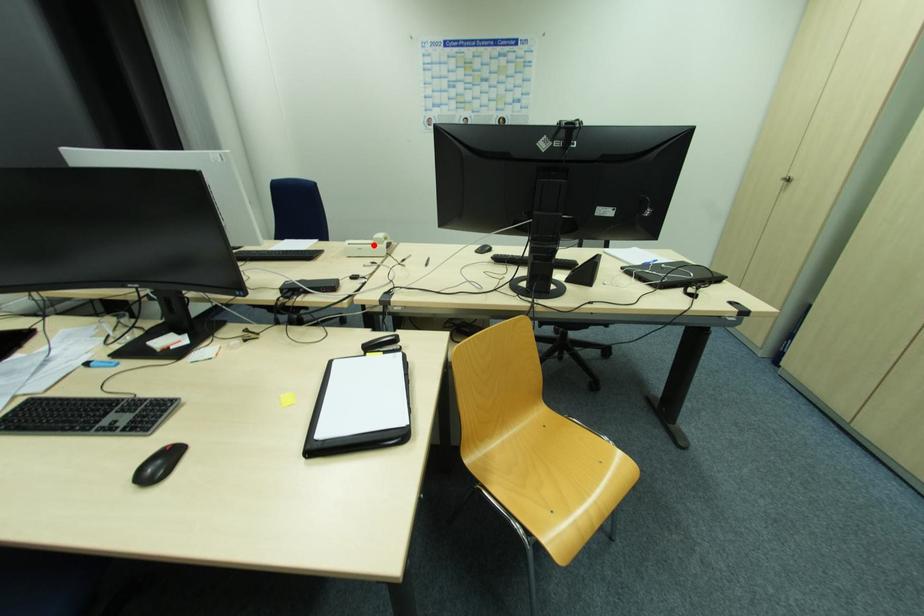
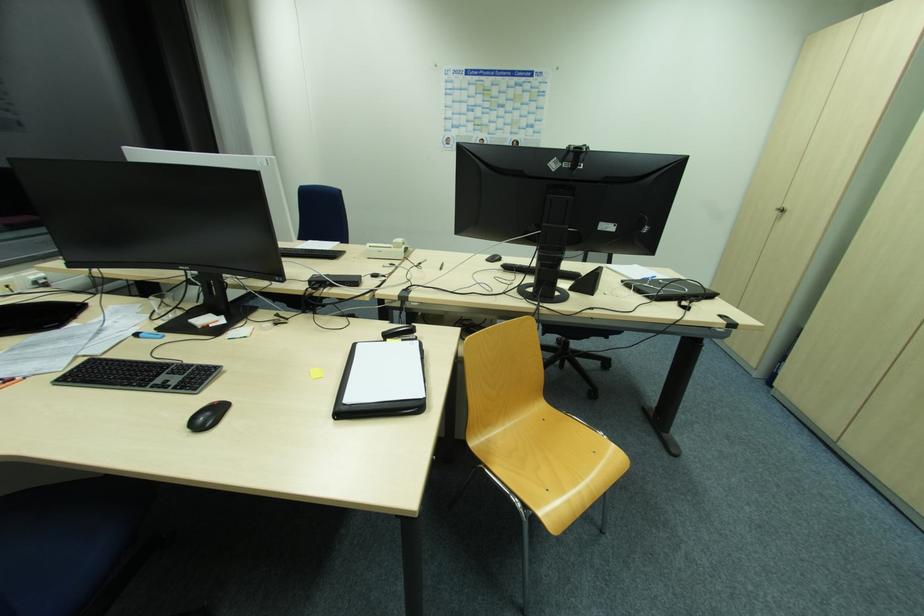
In the second image, find the point that corresponds to the highlighted location in the first image.

(393, 249)